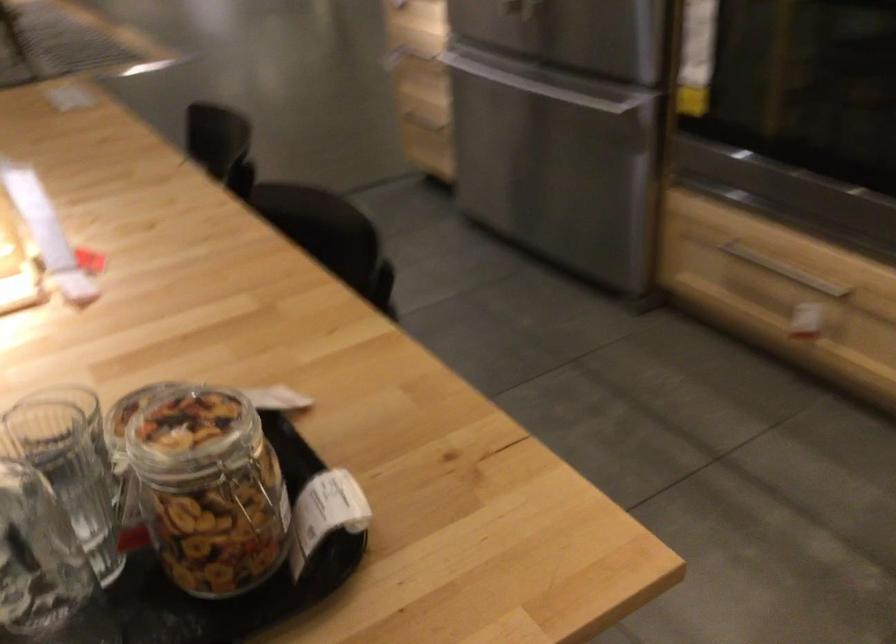
At what (x,y) coordinates should I click in order to perform the action: click on freezer drawer handle. Please return your answer as a coordinate pair (x, y). This screenshot has width=896, height=644. Looking at the image, I should click on (523, 68).